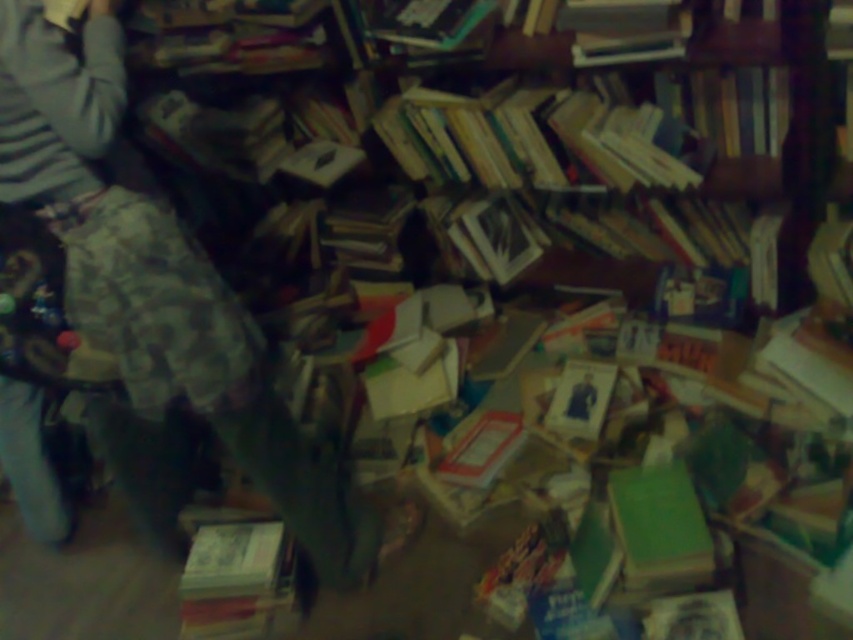
Question: Can you confirm if striped fabric at upper left is thinner than hardcover book at lower left?

Choices:
 (A) no
 (B) yes

Answer: (A)

Question: Can you confirm if striped fabric at upper left is positioned below wooden bookcase at upper center?

Choices:
 (A) yes
 (B) no

Answer: (A)

Question: Does striped fabric at upper left have a larger size compared to wooden bookcase at upper center?

Choices:
 (A) no
 (B) yes

Answer: (B)

Question: Which point is closer to the camera taking this photo?

Choices:
 (A) (788, 40)
 (B) (267, 620)

Answer: (B)

Question: Which of the following is the closest to the observer?

Choices:
 (A) (805, 262)
 (B) (62, 240)

Answer: (B)

Question: Which point is closer to the camera?

Choices:
 (A) striped fabric at upper left
 (B) wooden bookcase at upper center

Answer: (A)